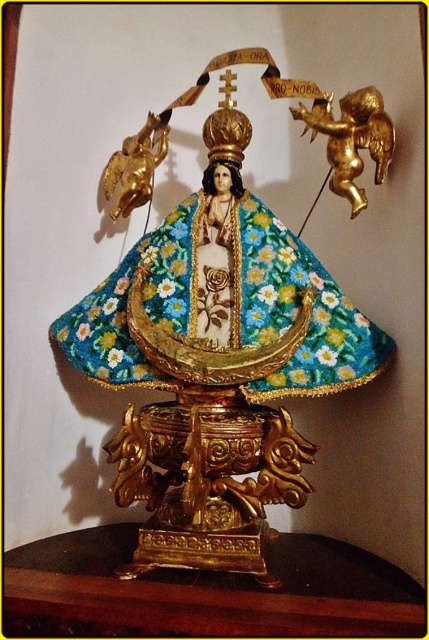
You are an art conservator assessing the space requirements for transporting the gold textured statue at center and the brown polished wood table at lower center. Based on their sizes, which object would require a larger storage container?

The gold textured statue at center requires a larger storage container because it has a larger size compared to the brown polished wood table at lower center.

You are an art conservator examining the religious artifact. The statue is positioned at coordinates. Where exactly is the gold textured statue at center located in terms of coordinates?

The gold textured statue at center is located at coordinates point (x=217, y=364).

You are an art conservator assessing the spatial arrangement of the religious artifact. The gold textured statue at center and the gold metallic cherub at upper right are both part of the display. Which object occupies more horizontal space in the composition?

The gold textured statue at center occupies more horizontal space than the gold metallic cherub at upper right because its width surpasses the cherub.